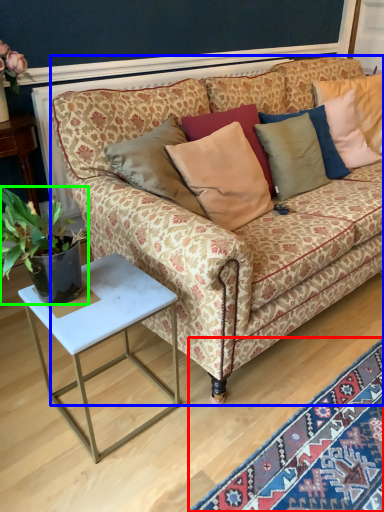
Question: Estimate the real-world distances between objects in this image. Which object is farther from mat (highlighted by a red box), studio couch (highlighted by a blue box) or houseplant (highlighted by a green box)?

Choices:
 (A) studio couch
 (B) houseplant

Answer: (B)